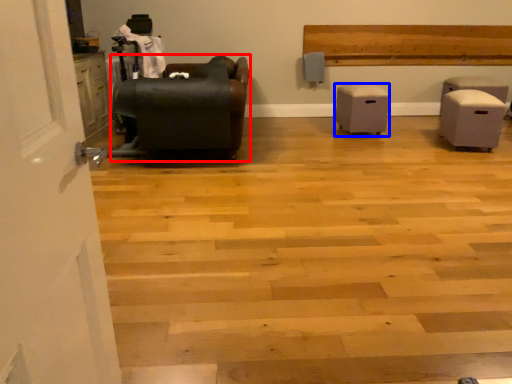
Question: Which point is further to the camera, furniture (highlighted by a red box) or furniture (highlighted by a blue box)?

Choices:
 (A) furniture
 (B) furniture

Answer: (B)